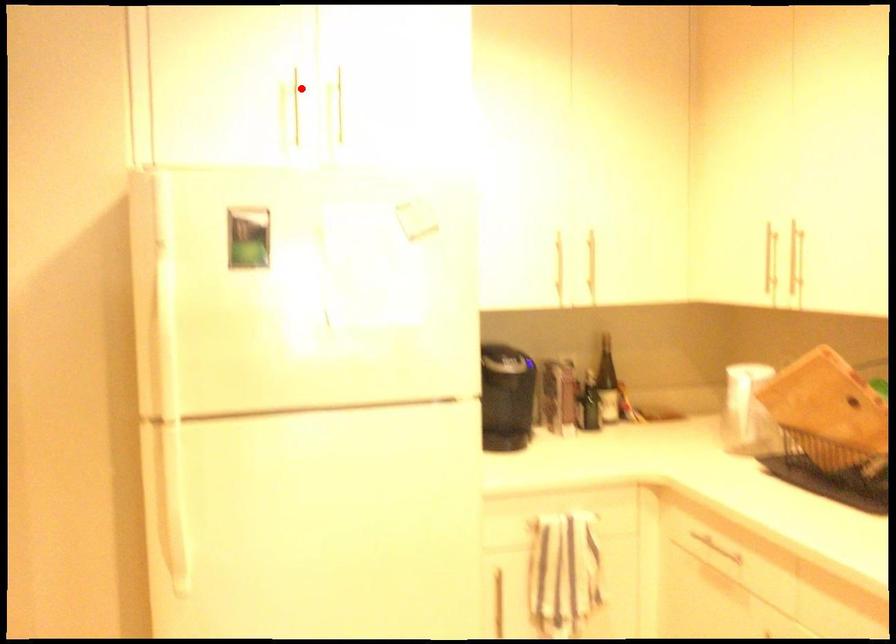
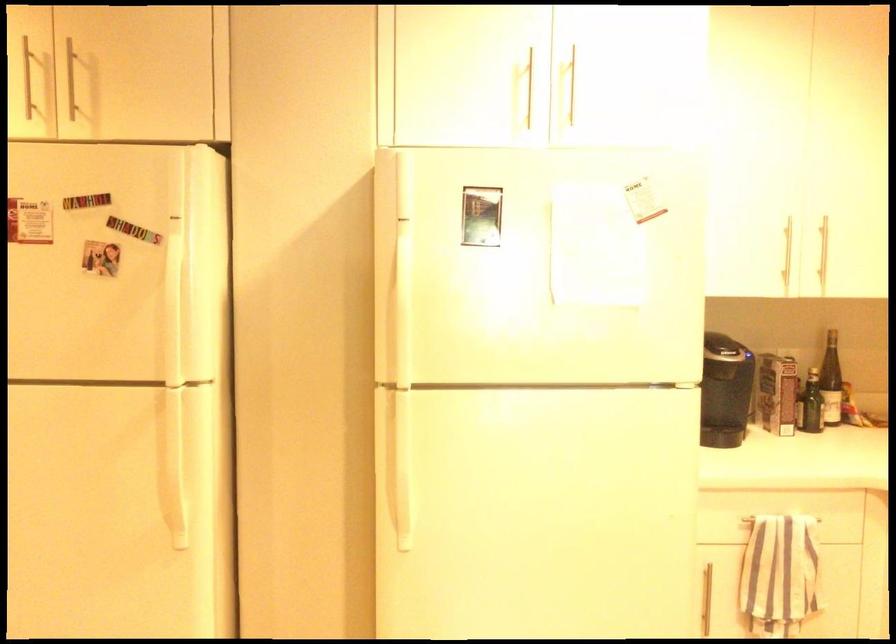
Where in the second image is the point corresponding to the highlighted location from the first image?

(540, 75)